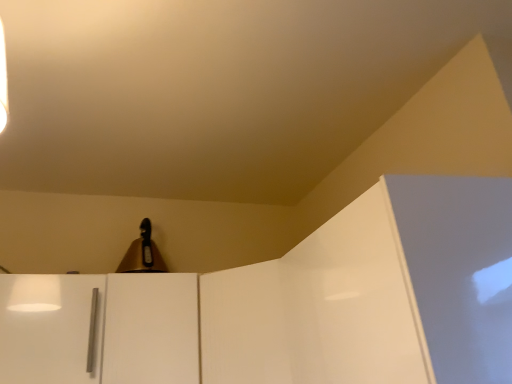
Where is `gold metallic bell at upper center`? The image size is (512, 384). gold metallic bell at upper center is located at coordinates (142, 254).

What are the coordinates of `white matte cabinet handle at lower left` in the screenshot? It's located at (101, 329).

Is white matte cabinet handle at lower left not inside gold metallic bell at upper center?

Yes, white matte cabinet handle at lower left is not within gold metallic bell at upper center.

Considering the relative sizes of white matte cabinet handle at lower left and gold metallic bell at upper center in the image provided, is white matte cabinet handle at lower left thinner than gold metallic bell at upper center?

No.

Who is shorter, white matte cabinet handle at lower left or gold metallic bell at upper center?

gold metallic bell at upper center is shorter.

Is point (198, 324) closer or farther from the camera than point (157, 263)?

Point (198, 324) is positioned closer to the camera compared to point (157, 263).

Is white glossy door at center not close to white matte cabinet handle at lower left?

No, there isn't a large distance between white glossy door at center and white matte cabinet handle at lower left.

Considering the relative sizes of white glossy door at center and white matte cabinet handle at lower left in the image provided, is white glossy door at center bigger than white matte cabinet handle at lower left?

Correct, white glossy door at center is larger in size than white matte cabinet handle at lower left.

From the image's perspective, would you say white glossy door at center is shown under white matte cabinet handle at lower left?

Yes, from the image's perspective, white glossy door at center is beneath white matte cabinet handle at lower left.

Image resolution: width=512 pixels, height=384 pixels. Identify the location of door below the white matte cabinet handle at lower left (from the image's perspective). (151, 328).

You are a GUI agent. You are given a task and a screenshot of the screen. Output one action in this format:
    pyautogui.click(x=<x>, y=<y>)
    Task: Click on the cabinetry below the gold metallic bell at upper center (from the image's perspective)
    
    Given the screenshot: What is the action you would take?
    pyautogui.click(x=101, y=329)

From the image's perspective, which one is positioned higher, gold metallic bell at upper center or white matte cabinet handle at lower left?

From the image's view, gold metallic bell at upper center is above.

Between gold metallic bell at upper center and white matte cabinet handle at lower left, which one has larger size?

With larger size is white matte cabinet handle at lower left.

Which is farther, (164, 265) or (124, 276)?

The point (164, 265) is more distant.

From a real-world perspective, is gold metallic bell at upper center physically located above or below white glossy door at center?

gold metallic bell at upper center is above white glossy door at center.

Between point (158, 260) and point (140, 314), which one is positioned behind?

Positioned behind is point (158, 260).

Between gold metallic bell at upper center and white glossy door at center, which one has larger width?

Wider between the two is white glossy door at center.

Is gold metallic bell at upper center taller than white glossy door at center?

Incorrect, the height of gold metallic bell at upper center is not larger of that of white glossy door at center.

Who is shorter, white glossy door at center or gold metallic bell at upper center?

With less height is gold metallic bell at upper center.

From the image's perspective, which one is positioned lower, white glossy door at center or gold metallic bell at upper center?

white glossy door at center.

Between white glossy door at center and gold metallic bell at upper center, which one appears on the right side from the viewer's perspective?

white glossy door at center is more to the right.

Is white glossy door at center beside gold metallic bell at upper center?

There is a gap between white glossy door at center and gold metallic bell at upper center.

Looking at this image, which object is further away from the camera taking this photo, white matte cabinet handle at lower left or white glossy door at center?

Positioned behind is white glossy door at center.

Is white matte cabinet handle at lower left surrounding white glossy door at center?

No.

Which of these two, white matte cabinet handle at lower left or white glossy door at center, stands shorter?

white matte cabinet handle at lower left is shorter.

Identify the location of cabinetry in front of the gold metallic bell at upper center. (101, 329).

This screenshot has height=384, width=512. What are the coordinates of `door on the right of white matte cabinet handle at lower left` in the screenshot? It's located at (151, 328).

Looking at the image, which one is located closer to white matte cabinet handle at lower left, white glossy door at center or gold metallic bell at upper center?

white glossy door at center.

Estimate the real-world distances between objects in this image. Which object is closer to white glossy door at center, gold metallic bell at upper center or white matte cabinet handle at lower left?

white matte cabinet handle at lower left is positioned closer to the anchor white glossy door at center.

Estimate the real-world distances between objects in this image. Which object is closer to gold metallic bell at upper center, white glossy door at center or white matte cabinet handle at lower left?

white glossy door at center lies closer to gold metallic bell at upper center than the other object.

Which object lies nearer to the anchor point white glossy door at center, white matte cabinet handle at lower left or gold metallic bell at upper center?

white matte cabinet handle at lower left lies closer to white glossy door at center than the other object.

Considering their positions, is gold metallic bell at upper center positioned further to white matte cabinet handle at lower left than white glossy door at center?

Among the two, gold metallic bell at upper center is located further to white matte cabinet handle at lower left.

Looking at the image, which one is located closer to gold metallic bell at upper center, white matte cabinet handle at lower left or white glossy door at center?

white glossy door at center is positioned closer to the anchor gold metallic bell at upper center.

Find the location of a particular element. This screenshot has height=384, width=512. door positioned between white matte cabinet handle at lower left and gold metallic bell at upper center from near to far is located at coordinates (151, 328).